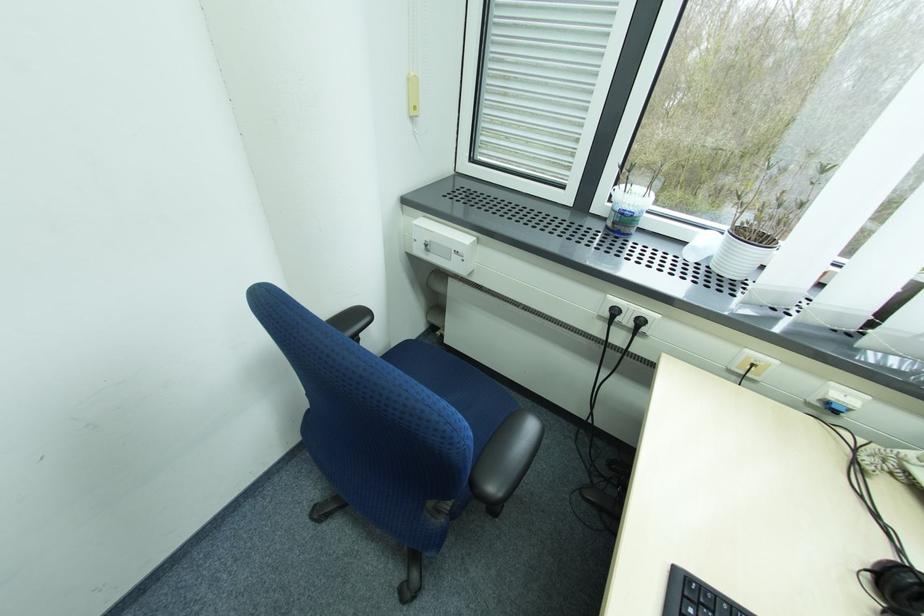
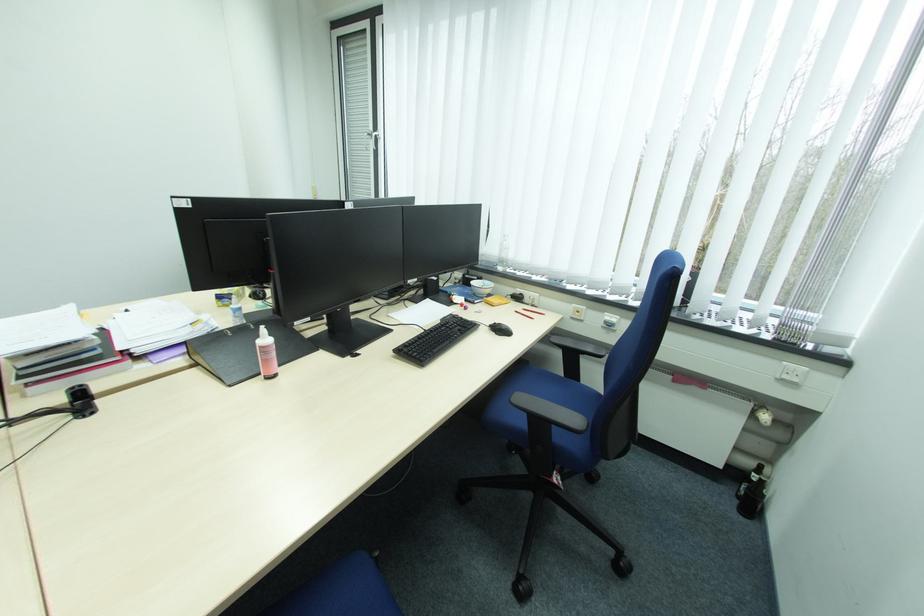
In a continuous first-person perspective shot, in which direction is the camera moving?

The movement direction of the cameraman is right, backward.